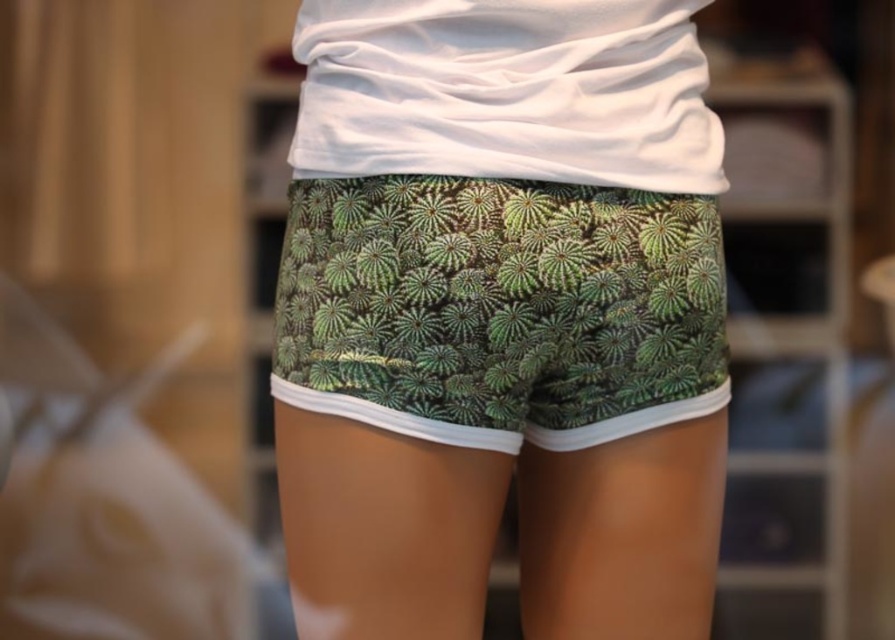
Question: Is green printed shorts at center positioned before green leafy fabric shorts at center?

Choices:
 (A) yes
 (B) no

Answer: (A)

Question: Observing the image, what is the correct spatial positioning of green printed shorts at center in reference to green leafy fabric shorts at center?

Choices:
 (A) above
 (B) below

Answer: (B)

Question: Which point appears closest to the camera in this image?

Choices:
 (A) (706, 326)
 (B) (679, 504)

Answer: (A)

Question: Which point is closer to the camera taking this photo?

Choices:
 (A) (510, 396)
 (B) (685, 435)

Answer: (A)

Question: Among these objects, which one is farthest from the camera?

Choices:
 (A) green leafy fabric shorts at center
 (B) green printed shorts at center

Answer: (A)

Question: Does green printed shorts at center have a lesser width compared to green leafy fabric shorts at center?

Choices:
 (A) yes
 (B) no

Answer: (A)